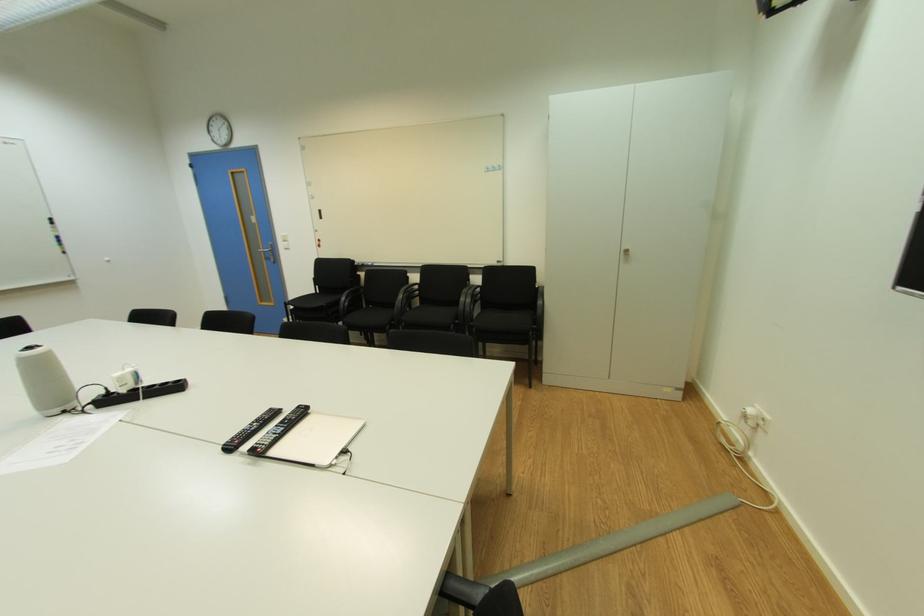
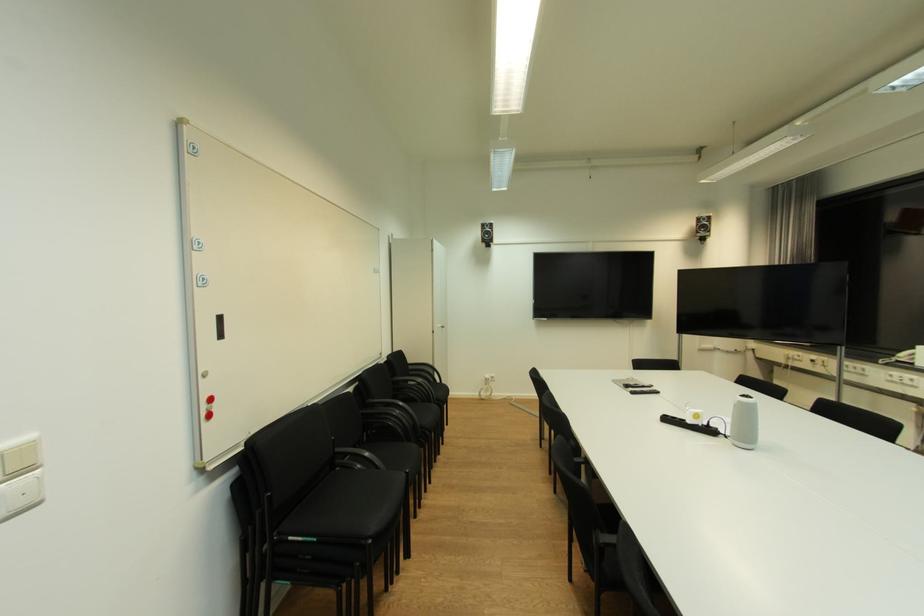
Find the pixel in the second image that matches point (293, 249) in the first image.

(26, 505)